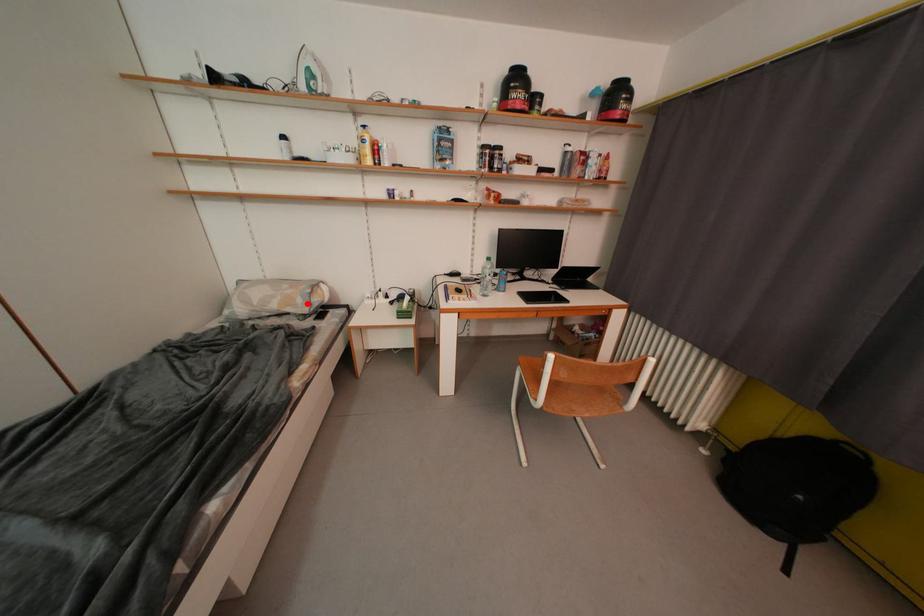
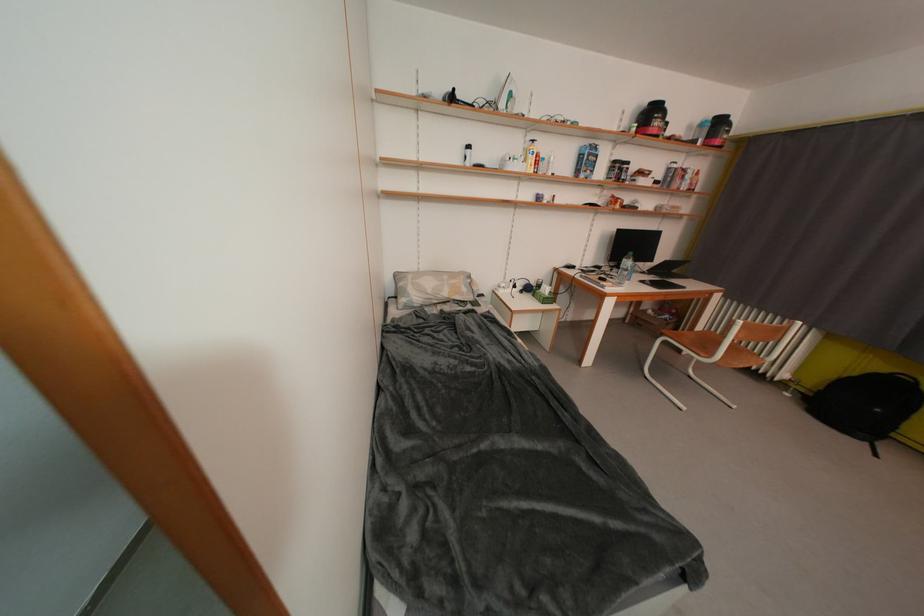
Find the pixel in the second image that matches the highlighted location in the first image.

(471, 293)